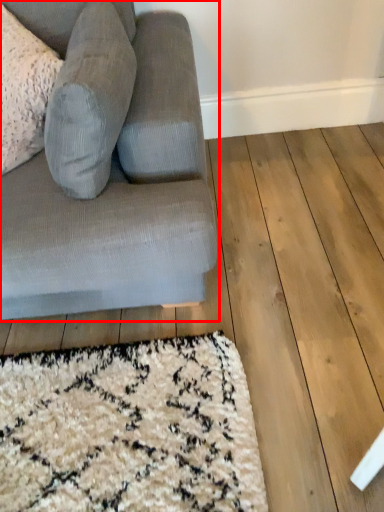
Question: From the image's perspective, what is the correct spatial positioning of studio couch (annotated by the red box) in reference to gray?

Choices:
 (A) above
 (B) below

Answer: (B)